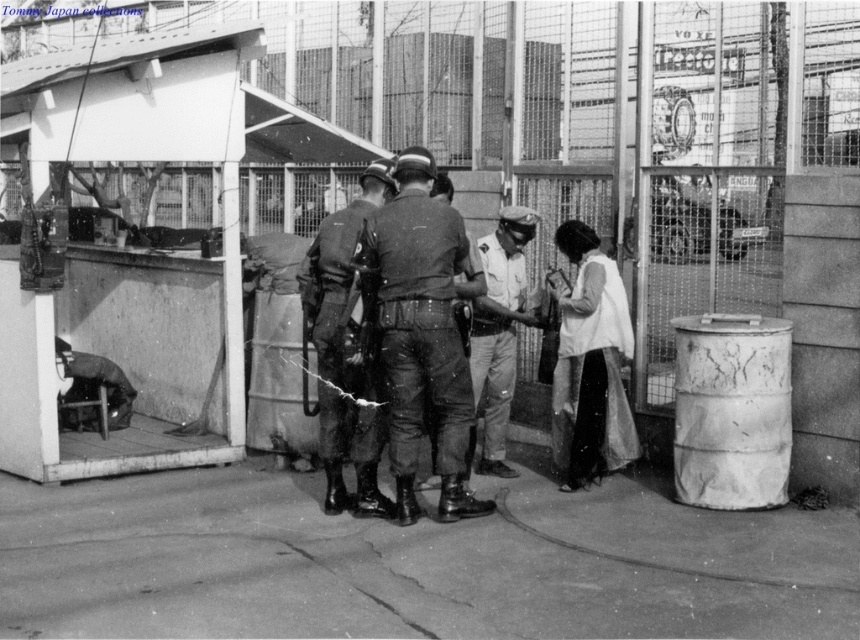
You are a visitor approaching the security checkpoint. You see the dark green fabric uniform at center and the uniformed man at center. Which object is positioned higher in the image?

The dark green fabric uniform at center is located above the uniformed man at center in the image.

You are a visitor approaching the security checkpoint in this historical image. You notice two points marked in the scene. Which point, point (x=412, y=266) or point (x=366, y=200), is closer to you as you approach the checkpoint?

Point (x=412, y=266) is closer to the viewer than point (x=366, y=200), so the point closer to you as you approach the checkpoint is point (x=412, y=266).